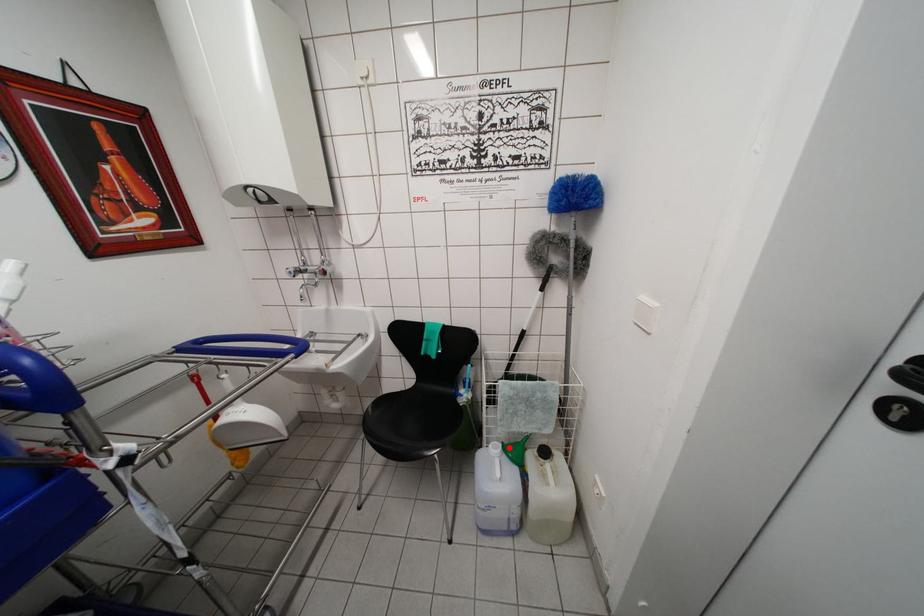
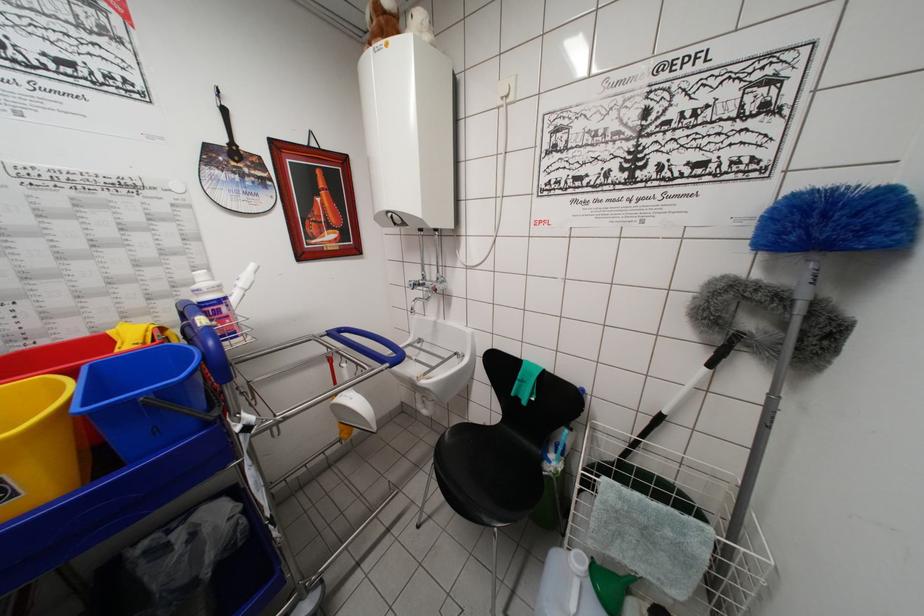
The point at the highlighted location is marked in the first image. Where is the corresponding point in the second image?

(601, 565)